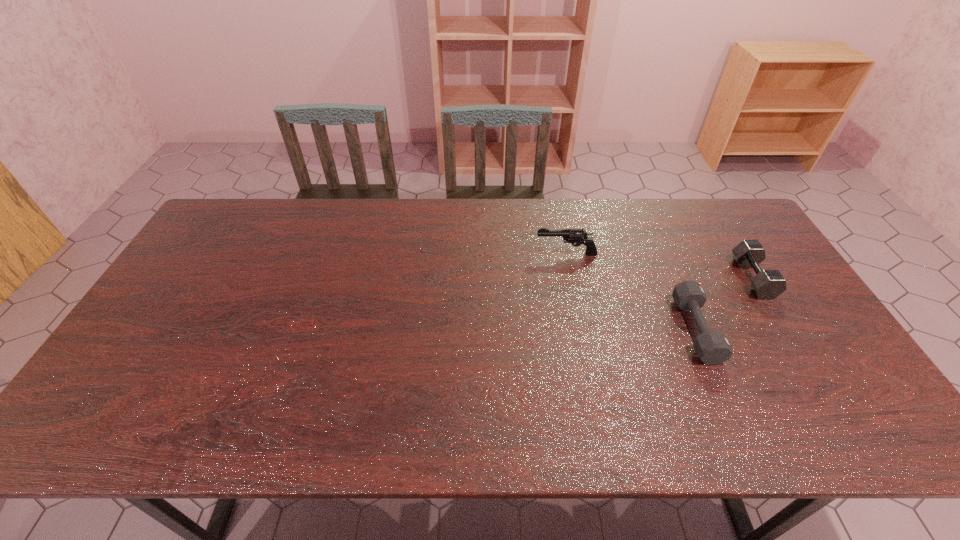
This screenshot has width=960, height=540. What are the coordinates of `blank region between the right dumbbell and the left dumbbell` in the screenshot? It's located at coord(724,304).

Locate an element on the screen. The height and width of the screenshot is (540, 960). free space between the right dumbbell and the leftmost object is located at coordinates (660, 266).

What are the coordinates of `free space between the tallest object and the rightmost object` in the screenshot? It's located at (660, 266).

You are a GUI agent. You are given a task and a screenshot of the screen. Output one action in this format:
    pyautogui.click(x=<x>, y=<y>)
    Task: Click on the closest object to the tallest object
    The image size is (960, 540).
    Given the screenshot: What is the action you would take?
    pyautogui.click(x=712, y=347)

Identify which object is located as the second nearest to the gun. Please provide its 2D coordinates. Your answer should be formatted as a tuple, i.e. [(x, y)], where the tuple contains the x and y coordinates of a point satisfying the conditions above.

[(767, 284)]

Where is `free point that satisfies the following two spatial constraints: 1. at the end of the barrel of the gun; 2. on the back side of the right dumbbell`? The image size is (960, 540). free point that satisfies the following two spatial constraints: 1. at the end of the barrel of the gun; 2. on the back side of the right dumbbell is located at coordinates (571, 278).

This screenshot has height=540, width=960. I want to click on blank space that satisfies the following two spatial constraints: 1. at the end of the barrel of the gun; 2. on the right side of the left dumbbell, so click(582, 329).

At what (x,y) coordinates should I click in order to perform the action: click on vacant position in the image that satisfies the following two spatial constraints: 1. at the end of the barrel of the right dumbbell; 2. on the right side of the leftmost object. Please return your answer as a coordinate pair (x, y). The image size is (960, 540). Looking at the image, I should click on (571, 278).

This screenshot has height=540, width=960. In order to click on free space that satisfies the following two spatial constraints: 1. at the end of the barrel of the leftmost object; 2. on the right side of the second object from left to right in this screenshot , I will do `click(582, 329)`.

Where is `vacant space that satisfies the following two spatial constraints: 1. at the end of the barrel of the second object from right to left; 2. on the right side of the leftmost object`? vacant space that satisfies the following two spatial constraints: 1. at the end of the barrel of the second object from right to left; 2. on the right side of the leftmost object is located at coordinates (582, 329).